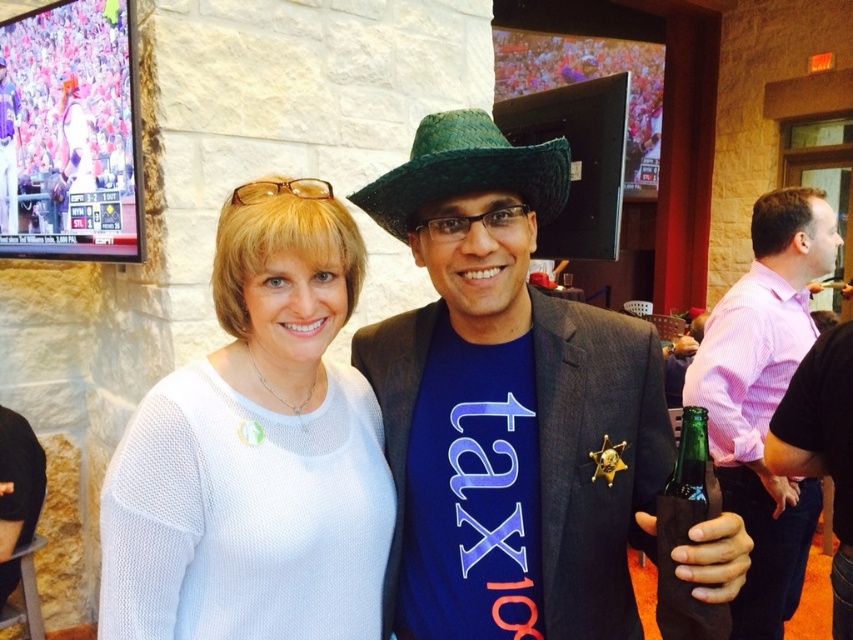
Does shiny blue t-shirt at center have a greater height compared to green glass bottle at lower right?

Correct, shiny blue t-shirt at center is much taller as green glass bottle at lower right.

Is shiny blue t-shirt at center to the right of green glass bottle at lower right from the viewer's perspective?

No, shiny blue t-shirt at center is not to the right of green glass bottle at lower right.

Which is behind, point (431, 253) or point (664, 609)?

The point (431, 253) is more distant.

Find the location of a particular element. shiny blue t-shirt at center is located at coordinates (506, 406).

Does green straw cowboy hat at center have a lesser width compared to green glass bottle at lower right?

In fact, green straw cowboy hat at center might be wider than green glass bottle at lower right.

Which of these two, green straw cowboy hat at center or green glass bottle at lower right, stands taller?

green glass bottle at lower right

Does point (521, 147) come closer to viewer compared to point (695, 496)?

No.

You are a GUI agent. You are given a task and a screenshot of the screen. Output one action in this format:
    pyautogui.click(x=<x>, y=<y>)
    Task: Click on the green straw cowboy hat at center
    Image resolution: width=853 pixels, height=640 pixels.
    Given the screenshot: What is the action you would take?
    pyautogui.click(x=466, y=172)

From the picture: Is white knitted sweater at center to the right of pink striped shirt at right from the viewer's perspective?

Incorrect, white knitted sweater at center is not on the right side of pink striped shirt at right.

Can you confirm if white knitted sweater at center is thinner than pink striped shirt at right?

Yes.

Between point (210, 577) and point (817, 252), which one is positioned in front?

Point (210, 577) is in front.

Locate an element on the screen. The height and width of the screenshot is (640, 853). white knitted sweater at center is located at coordinates (256, 451).